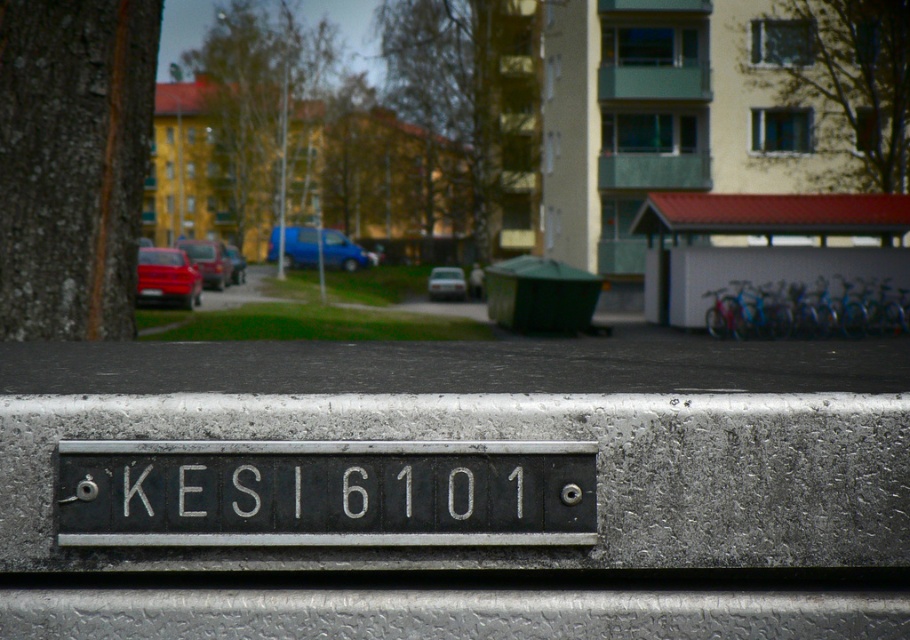
Is blue matte van at center bigger than metallic silver car at center?

Yes, blue matte van at center is bigger than metallic silver car at center.

Is blue matte van at center below metallic silver car at center?

No, blue matte van at center is not below metallic silver car at center.

Is point (285, 268) positioned after point (458, 298)?

Yes, point (285, 268) is behind point (458, 298).

I want to click on blue matte van at center, so click(x=322, y=250).

Does point (148, 474) lie in front of point (235, 246)?

Yes, it is.

Does white metallic text at center appear on the right side of matte blue van at center?

Correct, you'll find white metallic text at center to the right of matte blue van at center.

The height and width of the screenshot is (640, 910). What do you see at coordinates (329, 493) in the screenshot? I see `white metallic text at center` at bounding box center [329, 493].

What are the coordinates of `white metallic text at center` in the screenshot? It's located at 329,493.

Is point (436, 300) in front of point (240, 264)?

Yes, point (436, 300) is in front of point (240, 264).

Who is more forward, (442, 280) or (235, 268)?

Point (442, 280) is more forward.

Find the location of `metallic silver car at center`. metallic silver car at center is located at coordinates (446, 284).